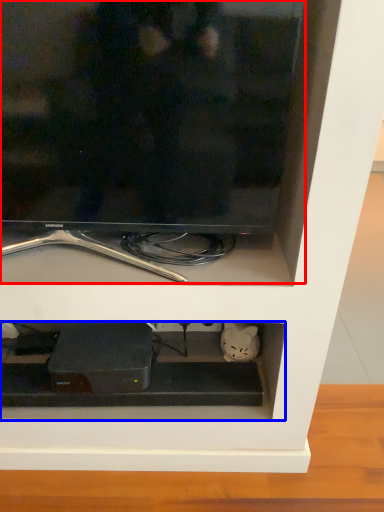
Question: Which object is closer to the camera taking this photo, television (highlighted by a red box) or cabinet (highlighted by a blue box)?

Choices:
 (A) television
 (B) cabinet

Answer: (A)